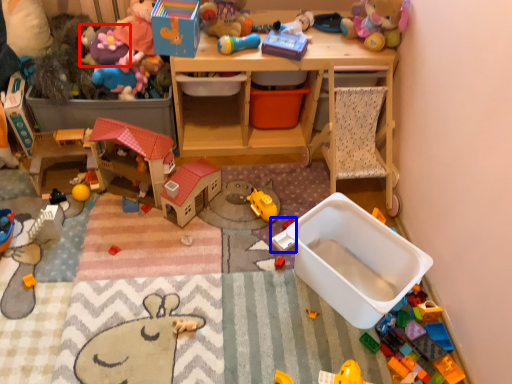
Question: Which object is closer to the camera taking this photo, toy (highlighted by a red box) or toy (highlighted by a blue box)?

Choices:
 (A) toy
 (B) toy

Answer: (B)